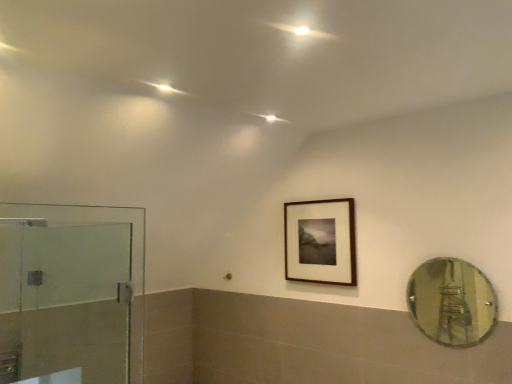
Question: Can you confirm if wooden frame at upper center is bigger than clear glass mirror at right?

Choices:
 (A) yes
 (B) no

Answer: (A)

Question: From a real-world perspective, is wooden frame at upper center under clear glass mirror at right?

Choices:
 (A) yes
 (B) no

Answer: (B)

Question: Can you confirm if wooden frame at upper center is shorter than clear glass mirror at right?

Choices:
 (A) yes
 (B) no

Answer: (B)

Question: Is wooden frame at upper center positioned before clear glass mirror at right?

Choices:
 (A) yes
 (B) no

Answer: (B)

Question: Is clear glass mirror at right surrounded by wooden frame at upper center?

Choices:
 (A) yes
 (B) no

Answer: (B)

Question: Based on their positions, is transparent glass shower door at left located to the left or right of clear glass mirror at right?

Choices:
 (A) left
 (B) right

Answer: (A)

Question: Is transparent glass shower door at left inside or outside of clear glass mirror at right?

Choices:
 (A) outside
 (B) inside

Answer: (A)

Question: Is transparent glass shower door at left in front of or behind clear glass mirror at right in the image?

Choices:
 (A) front
 (B) behind

Answer: (A)

Question: Looking at the image, does transparent glass shower door at left seem bigger or smaller compared to clear glass mirror at right?

Choices:
 (A) big
 (B) small

Answer: (A)

Question: Considering their positions, is clear glass mirror at right located in front of or behind wooden frame at upper center?

Choices:
 (A) behind
 (B) front

Answer: (B)

Question: From their relative heights in the image, would you say clear glass mirror at right is taller or shorter than wooden frame at upper center?

Choices:
 (A) short
 (B) tall

Answer: (A)

Question: Is point (493, 321) closer or farther from the camera than point (305, 249)?

Choices:
 (A) closer
 (B) farther

Answer: (A)

Question: Is clear glass mirror at right to the left or to the right of wooden frame at upper center in the image?

Choices:
 (A) left
 (B) right

Answer: (B)

Question: In the image, is wooden frame at upper center positioned in front of or behind clear glass mirror at right?

Choices:
 (A) front
 (B) behind

Answer: (B)

Question: Visually, is wooden frame at upper center positioned to the left or to the right of clear glass mirror at right?

Choices:
 (A) right
 (B) left

Answer: (B)